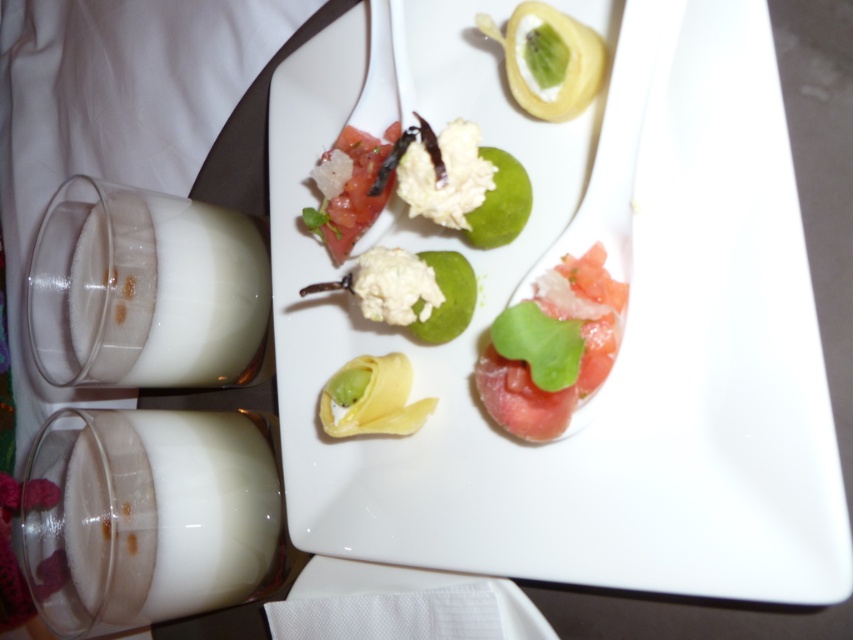
Question: Which of these objects is positioned farthest from the white creamy milk at left?

Choices:
 (A) smooth yellow pastry at upper center
 (B) matte white tomato at center

Answer: (A)

Question: Does white creamy milk at left have a greater width compared to yellow matte pastry at center?

Choices:
 (A) yes
 (B) no

Answer: (A)

Question: Is white creamy milk at left further to camera compared to smooth yellow pastry at upper center?

Choices:
 (A) no
 (B) yes

Answer: (B)

Question: Does white creamy milk at lower left have a greater width compared to yellow matte pastry at center?

Choices:
 (A) no
 (B) yes

Answer: (B)

Question: Which point is farther to the camera?

Choices:
 (A) yellow matte pastry at center
 (B) white creamy milk at left
 (C) white glossy plate at upper center

Answer: (B)

Question: Which point is closer to the camera?

Choices:
 (A) (334, 176)
 (B) (67, 554)
 (C) (264, 314)

Answer: (A)